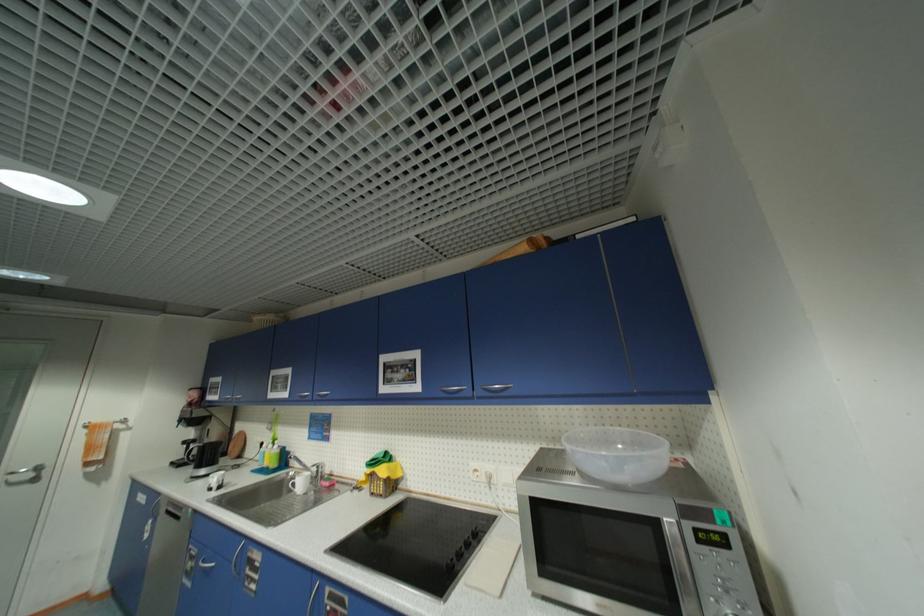
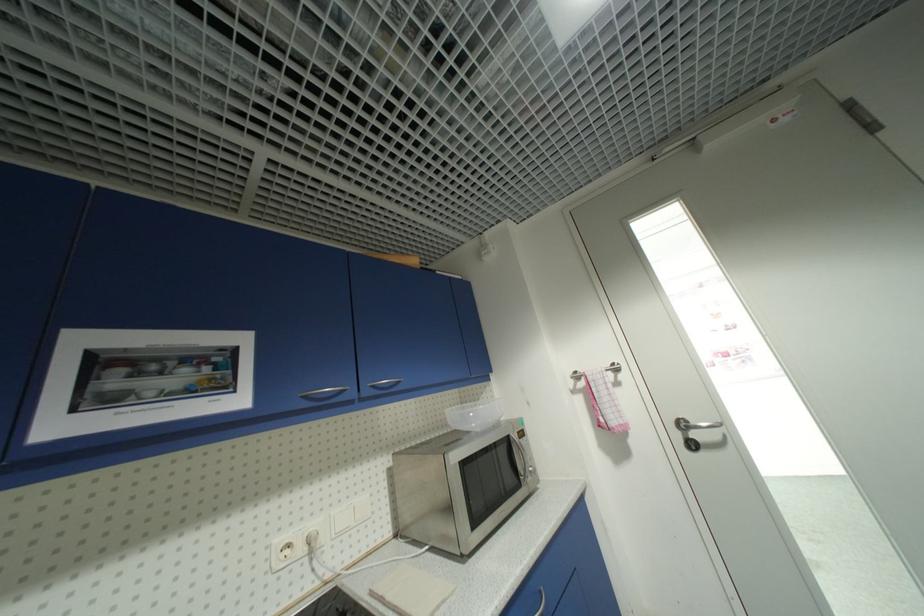
In the second image, find the point that corresponds to pixel 448 392 in the first image.

(311, 399)